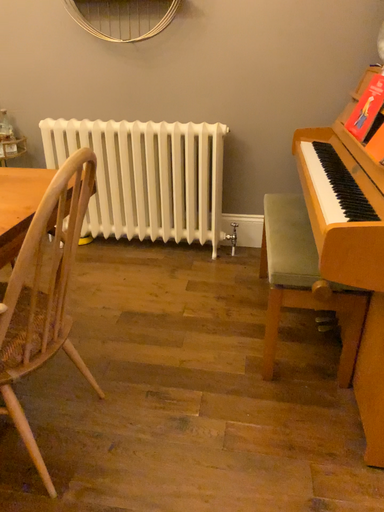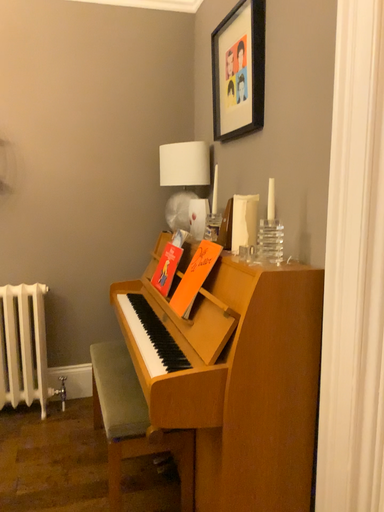
Question: How did the camera likely rotate when shooting the video?

Choices:
 (A) rotated downward
 (B) rotated upward

Answer: (B)